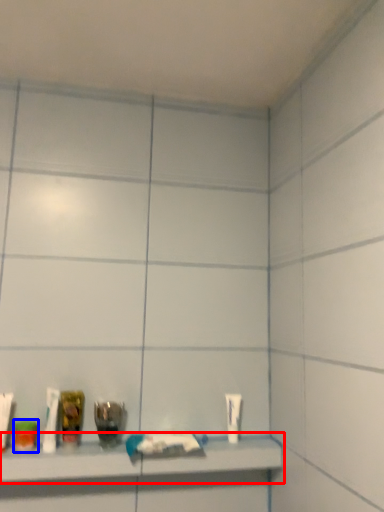
Question: Among these objects, which one is farthest to the camera, shelf (highlighted by a red box) or mouthwash (highlighted by a blue box)?

Choices:
 (A) shelf
 (B) mouthwash

Answer: (B)